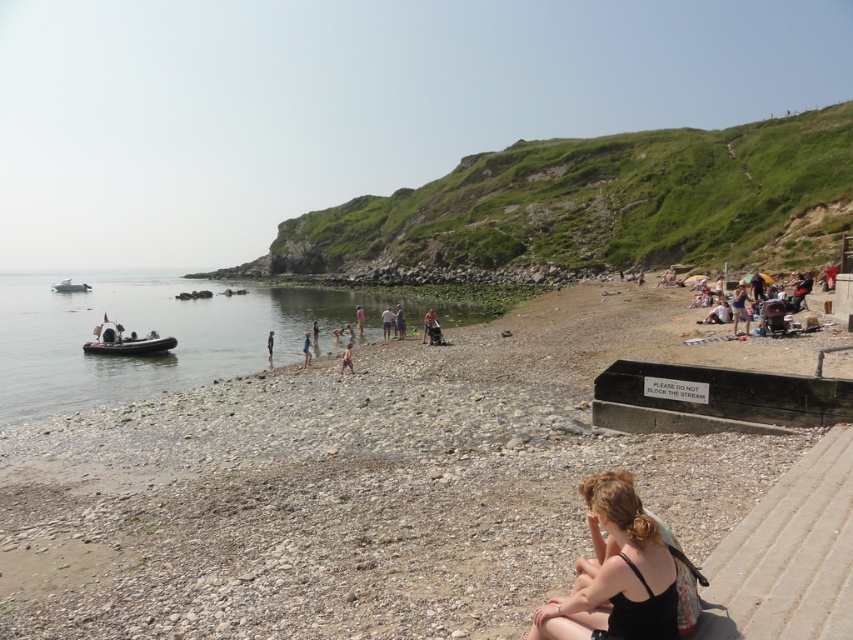
Can you confirm if translucent rubber dinghy at lower left is shorter than matte black hair at lower right?

Incorrect, translucent rubber dinghy at lower left's height does not fall short of matte black hair at lower right's.

Is point (349, 298) positioned behind point (563, 628)?

Yes, point (349, 298) is behind point (563, 628).

Which is in front, point (218, 356) or point (596, 534)?

Positioned in front is point (596, 534).

Image resolution: width=853 pixels, height=640 pixels. Find the location of `translucent rubber dinghy at lower left`. translucent rubber dinghy at lower left is located at coordinates (148, 332).

Which is above, matte black hair at lower right or light blue fabric at center?

Positioned higher is light blue fabric at center.

Is matte black hair at lower right to the left of light blue fabric at center from the viewer's perspective?

No, matte black hair at lower right is not to the left of light blue fabric at center.

In order to click on matte black hair at lower right in this screenshot , I will do `click(616, 572)`.

Can you confirm if white glossy boat at left is taller than tan skin person at center?

Yes, white glossy boat at left is taller than tan skin person at center.

Identify the location of white glossy boat at left. (70, 285).

This screenshot has width=853, height=640. I want to click on white glossy boat at left, so click(x=70, y=285).